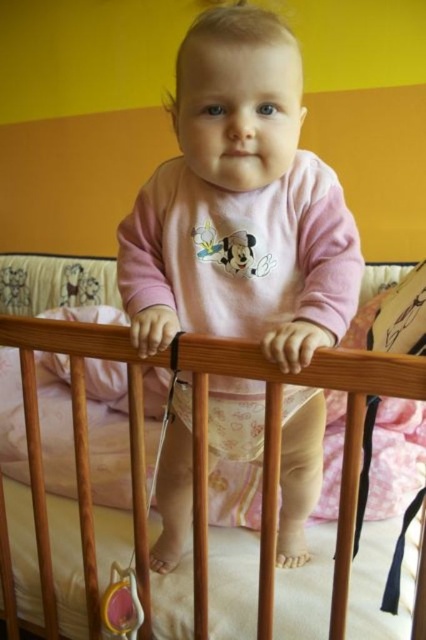
Question: Which point appears farthest from the camera in this image?

Choices:
 (A) coord(13,378)
 (B) coord(244,200)

Answer: (A)

Question: Considering the relative positions of pink matte/satin baby at center and wooden crib at center in the image provided, where is pink matte/satin baby at center located with respect to wooden crib at center?

Choices:
 (A) left
 (B) right

Answer: (B)

Question: Does pink matte/satin baby at center have a greater width compared to wooden crib at center?

Choices:
 (A) no
 (B) yes

Answer: (A)

Question: Is the position of pink matte/satin baby at center more distant than that of wooden crib at center?

Choices:
 (A) yes
 (B) no

Answer: (B)